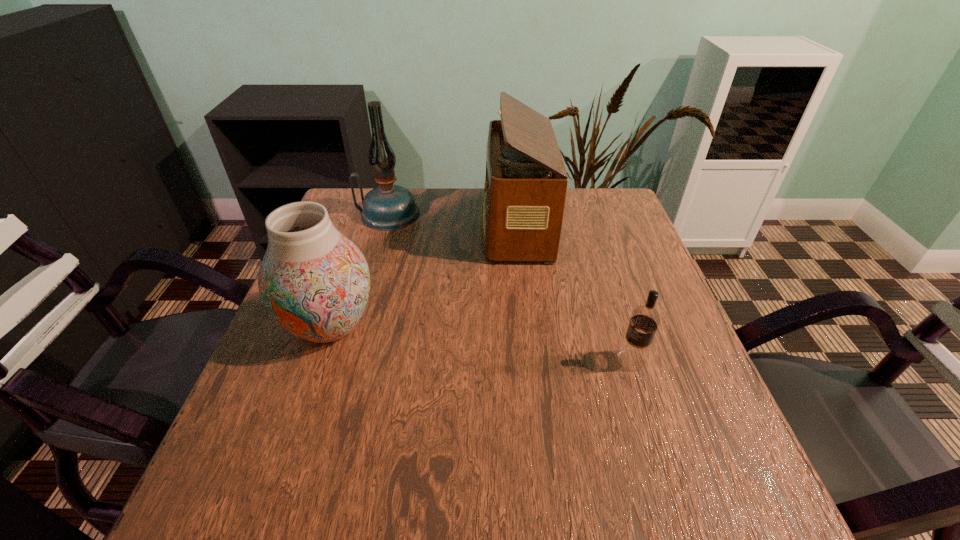
Find the location of a particular element. This screenshot has height=540, width=960. free space at the near edge of the desktop is located at coordinates (464, 498).

Locate an element on the screen. The width and height of the screenshot is (960, 540). free space at the left edge of the desktop is located at coordinates (365, 245).

Find the location of a particular element. blank area at the right edge is located at coordinates (612, 294).

In the image, there is a desktop. Find the location of `vacant region at the far left corner`. vacant region at the far left corner is located at coordinates (350, 198).

The width and height of the screenshot is (960, 540). In order to click on vacant region at the far right corner in this screenshot , I will do `click(574, 206)`.

The width and height of the screenshot is (960, 540). Find the location of `free space at the near right corner of the desktop`. free space at the near right corner of the desktop is located at coordinates click(772, 525).

The height and width of the screenshot is (540, 960). I want to click on empty space that is in between the oil lamp and the radio receiver, so click(452, 219).

The width and height of the screenshot is (960, 540). Find the location of `vacant area between the oil lamp and the vodka`. vacant area between the oil lamp and the vodka is located at coordinates (510, 287).

You are a GUI agent. You are given a task and a screenshot of the screen. Output one action in this format:
    pyautogui.click(x=<x>, y=<y>)
    Task: Click on the vacant area that lies between the oil lamp and the shortest object
    The width and height of the screenshot is (960, 540).
    Given the screenshot: What is the action you would take?
    pyautogui.click(x=510, y=287)

Locate an element on the screen. This screenshot has width=960, height=540. vacant space that is in between the vodka and the second object from right to left is located at coordinates (573, 292).